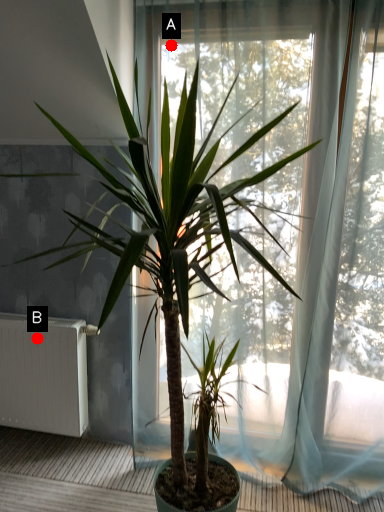
Question: Two points are circled on the image, labeled by A and B beside each circle. Which of the following is the closest to the observer?

Choices:
 (A) A is closer
 (B) B is closer

Answer: (A)